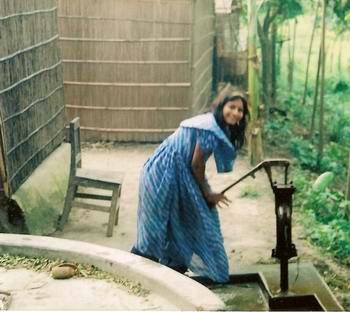
Identify the location of cloth. [x=46, y=190].